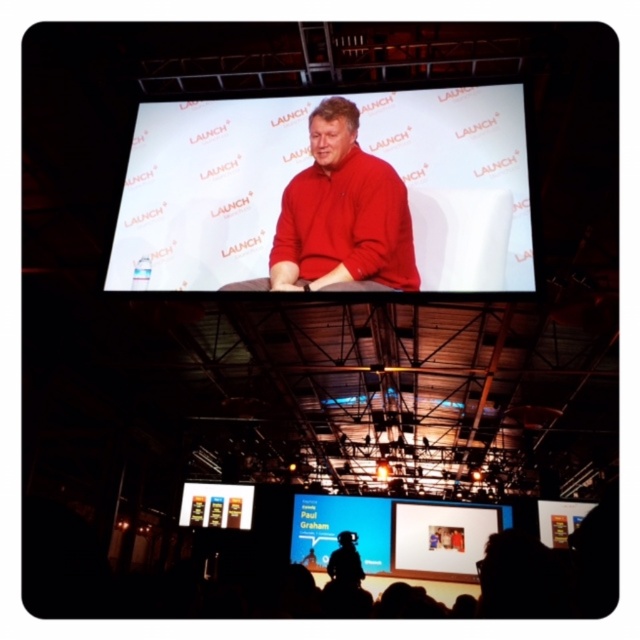
You are an attendee at the LAUNCH event sitting in the front row. You notice two points marked in the image. The first point is at coordinate point (120,241) and the second is at point (353,552). Which point is closer to you as an attendee?

Point (120,241) is closer to the viewer than point (353,552).

Based on the scene description, can you determine which object, the matte white screen at center or the silhouette figure at center, is larger in size?

The silhouette figure at center is larger than the matte white screen at center according to the description.